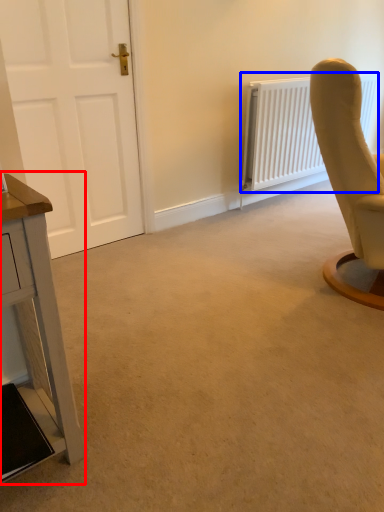
Question: Which point is further to the camera, table (highlighted by a red box) or radiator (highlighted by a blue box)?

Choices:
 (A) table
 (B) radiator

Answer: (B)